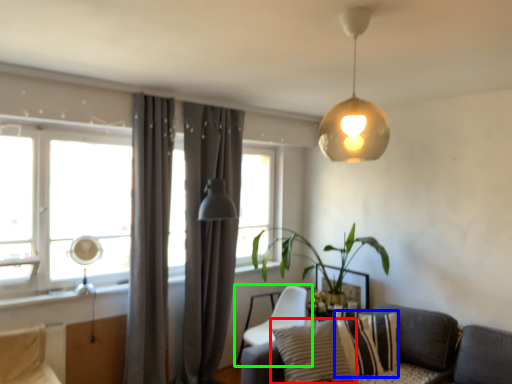
Question: Considering the real-world distances, which object is farthest from pillow (highlighted by a red box)? pillow (highlighted by a blue box) or chair (highlighted by a green box)?

Choices:
 (A) pillow
 (B) chair

Answer: (B)